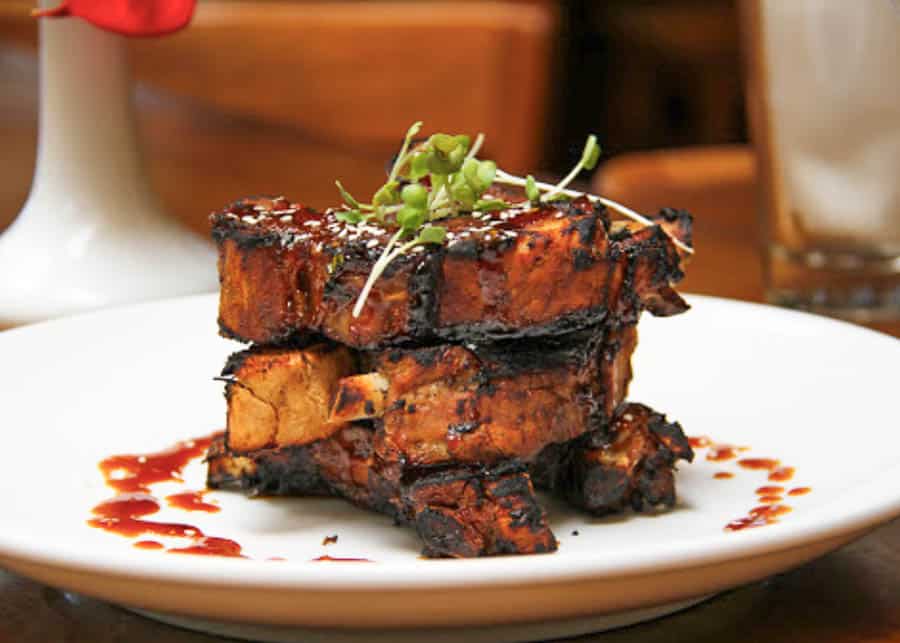
Where is `bottom of plate`? The width and height of the screenshot is (900, 643). bottom of plate is located at coordinates (407, 622).